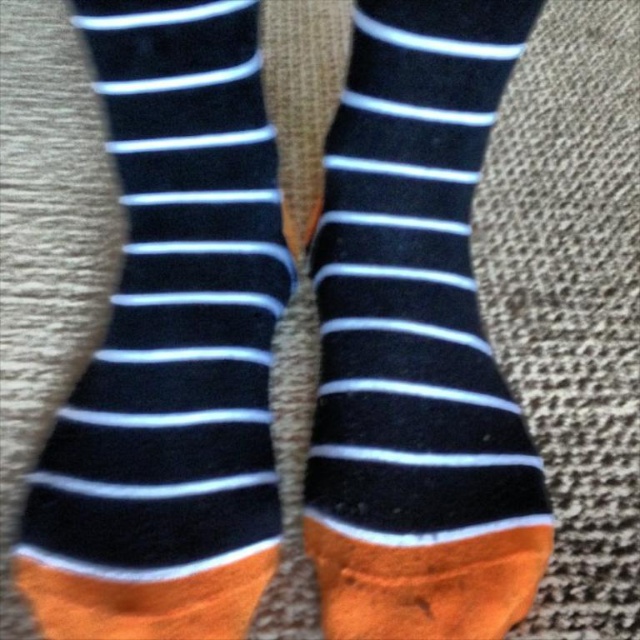
Question: Which point is closer to the camera?

Choices:
 (A) (202, 632)
 (B) (477, 337)

Answer: (A)

Question: Which point appears farthest from the camera in this image?

Choices:
 (A) (76, 486)
 (B) (337, 317)

Answer: (B)

Question: Does matte black and orange socks at center lie behind navy blue/white striped sock at center?

Choices:
 (A) yes
 (B) no

Answer: (B)

Question: Is matte black and orange socks at center above navy blue/white striped sock at center?

Choices:
 (A) no
 (B) yes

Answer: (B)

Question: Is matte black and orange socks at center positioned in front of navy blue/white striped sock at center?

Choices:
 (A) yes
 (B) no

Answer: (A)